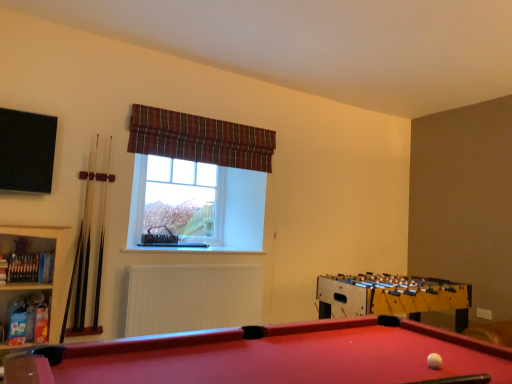
Locate an element on the screen. The height and width of the screenshot is (384, 512). light brown wooden cue at left, the second cue in the right-to-left sequence is located at coordinates (84, 245).

Consider the image. What is the approximate height of light brown wooden cue at left, the second cue in the right-to-left sequence?

4.28 feet.

What do you see at coordinates (434, 361) in the screenshot?
I see `white matte ball at lower right` at bounding box center [434, 361].

This screenshot has height=384, width=512. Describe the element at coordinates (102, 239) in the screenshot. I see `white wood cue at left, positioned as the second cue in left-to-right order` at that location.

In order to click on rubberized felt pool table at lower left in this screenshot , I will do `click(269, 356)`.

What is the approximate width of rubberized felt pool table at lower left?

rubberized felt pool table at lower left is 38.50 inches wide.

Where is `plaid fabric curtain at upper center`? plaid fabric curtain at upper center is located at coordinates (199, 139).

In the scene shown: From the image's perspective, is clear glass window at center under wooden bookshelf at left?

No, from the image's perspective, clear glass window at center is not beneath wooden bookshelf at left.

Is clear glass window at center oriented away from wooden bookshelf at left?

No.

Does clear glass window at center have a lesser height compared to wooden bookshelf at left?

Indeed, clear glass window at center has a lesser height compared to wooden bookshelf at left.

Is clear glass window at center located outside wooden bookshelf at left?

Yes, clear glass window at center is outside of wooden bookshelf at left.

From the image's perspective, is white wood cue at left, the first cue when ordered from right to left, located beneath yellow wooden foosball table at right?

No, from the image's perspective, white wood cue at left, the first cue when ordered from right to left, is not below yellow wooden foosball table at right.

Considering the sizes of objects white wood cue at left, the first cue when ordered from right to left, and yellow wooden foosball table at right in the image provided, who is bigger, white wood cue at left, the first cue when ordered from right to left, or yellow wooden foosball table at right?

yellow wooden foosball table at right is bigger.

Can you confirm if white wood cue at left, positioned as the second cue in left-to-right order, is wider than yellow wooden foosball table at right?

Incorrect, the width of white wood cue at left, positioned as the second cue in left-to-right order, does not surpass that of yellow wooden foosball table at right.

Which of these two, white wood cue at left, the first cue when ordered from right to left, or yellow wooden foosball table at right, stands taller?

white wood cue at left, the first cue when ordered from right to left.

Between yellow wooden foosball table at right and wooden bookshelf at left, which one appears on the right side from the viewer's perspective?

yellow wooden foosball table at right.

Is yellow wooden foosball table at right turned away from wooden bookshelf at left?

yellow wooden foosball table at right is not turned away from wooden bookshelf at left.

From a real-world perspective, between yellow wooden foosball table at right and wooden bookshelf at left, who is vertically higher?

wooden bookshelf at left is physically above.

Locate an element on the screen. This screenshot has width=512, height=384. bookshelf on the left of yellow wooden foosball table at right is located at coordinates (28, 282).

Considering the relative sizes of clear glass window at center and white matte ball at lower right in the image provided, is clear glass window at center taller than white matte ball at lower right?

Indeed, clear glass window at center has a greater height compared to white matte ball at lower right.

Which of these two, clear glass window at center or white matte ball at lower right, is wider?

clear glass window at center is wider.

Does point (145, 232) appear closer or farther from the camera than point (440, 358)?

Point (145, 232) is positioned farther from the camera compared to point (440, 358).

Does point (439, 369) come behind point (367, 275)?

That is False.

From the picture: Can you confirm if white matte ball at lower right is smaller than yellow wooden foosball table at right?

Correct, white matte ball at lower right occupies less space than yellow wooden foosball table at right.

Between white matte ball at lower right and yellow wooden foosball table at right, which one has larger width?

With larger width is yellow wooden foosball table at right.

Does yellow wooden foosball table at right contain plaid fabric curtain at upper center?

Definitely not — plaid fabric curtain at upper center is not inside yellow wooden foosball table at right.

From the picture: From a real-world perspective, is yellow wooden foosball table at right above or below plaid fabric curtain at upper center?

yellow wooden foosball table at right is situated lower than plaid fabric curtain at upper center in the real world.

Is yellow wooden foosball table at right shorter than plaid fabric curtain at upper center?

No, yellow wooden foosball table at right is not shorter than plaid fabric curtain at upper center.

Which is more distant, (396, 299) or (143, 127)?

The point (143, 127) is behind.

Is wooden bookshelf at left not within white wood cue at left, the first cue when ordered from right to left?

Yes, wooden bookshelf at left is not within white wood cue at left, the first cue when ordered from right to left.

Does point (38, 255) lie behind point (102, 247)?

No, (38, 255) is closer to viewer.

Image resolution: width=512 pixels, height=384 pixels. I want to click on bookshelf lying on the left of clear glass window at center, so click(x=28, y=282).

You are a GUI agent. You are given a task and a screenshot of the screen. Output one action in this format:
    pyautogui.click(x=<x>, y=<y>)
    Task: Click on the 2nd cue directly above the yellow wooden foosball table at right (from a real-world perspective)
    
    Given the screenshot: What is the action you would take?
    pyautogui.click(x=102, y=239)

Estimate the real-world distances between objects in this image. Which object is further from rubberized felt pool table at lower left, wooden bookshelf at left or white textured radiator at center?

The object further to rubberized felt pool table at lower left is white textured radiator at center.

Based on their spatial positions, is white wood cue at left, positioned as the second cue in left-to-right order, or plaid fabric curtain at upper center further from white textured radiator at center?

The object further to white textured radiator at center is plaid fabric curtain at upper center.

Which object lies nearer to the anchor point white wood cue at left, the first cue when ordered from right to left, black matte screen at upper left or light brown wooden cue at left, acting as the first cue starting from the left?

Based on the image, light brown wooden cue at left, acting as the first cue starting from the left, appears to be nearer to white wood cue at left, the first cue when ordered from right to left.

Looking at the image, which one is located further to wooden bookshelf at left, plaid fabric curtain at upper center or black matte screen at upper left?

plaid fabric curtain at upper center is further to wooden bookshelf at left.

From the image, which object appears to be farther from rubberized felt pool table at lower left, plaid fabric curtain at upper center or light brown wooden cue at left, the second cue in the right-to-left sequence?

Among the two, plaid fabric curtain at upper center is located further to rubberized felt pool table at lower left.

Estimate the real-world distances between objects in this image. Which object is closer to rubberized felt pool table at lower left, white matte ball at lower right or white wood cue at left, positioned as the second cue in left-to-right order?

white matte ball at lower right is closer to rubberized felt pool table at lower left.

Estimate the real-world distances between objects in this image. Which object is further from clear glass window at center, yellow wooden foosball table at right or light brown wooden cue at left, the second cue in the right-to-left sequence?

Among the two, yellow wooden foosball table at right is located further to clear glass window at center.

Based on the photo, from the image, which object appears to be farther from wooden bookshelf at left, plaid fabric curtain at upper center or white wood cue at left, the first cue when ordered from right to left?

plaid fabric curtain at upper center lies further to wooden bookshelf at left than the other object.

At what (x,y) coordinates should I click in order to perform the action: click on curtain situated between white wood cue at left, positioned as the second cue in left-to-right order, and yellow wooden foosball table at right from left to right. Please return your answer as a coordinate pair (x, y). This screenshot has width=512, height=384. Looking at the image, I should click on (199, 139).

Identify the location of ball positioned between rubberized felt pool table at lower left and clear glass window at center from near to far. (434, 361).

Where is `curtain located between white textured radiator at center and yellow wooden foosball table at right in the left-right direction`? This screenshot has height=384, width=512. curtain located between white textured radiator at center and yellow wooden foosball table at right in the left-right direction is located at coordinates [199, 139].

At what (x,y) coordinates should I click in order to perform the action: click on curtain between light brown wooden cue at left, the second cue in the right-to-left sequence, and yellow wooden foosball table at right from left to right. Please return your answer as a coordinate pair (x, y). The image size is (512, 384). Looking at the image, I should click on (199, 139).